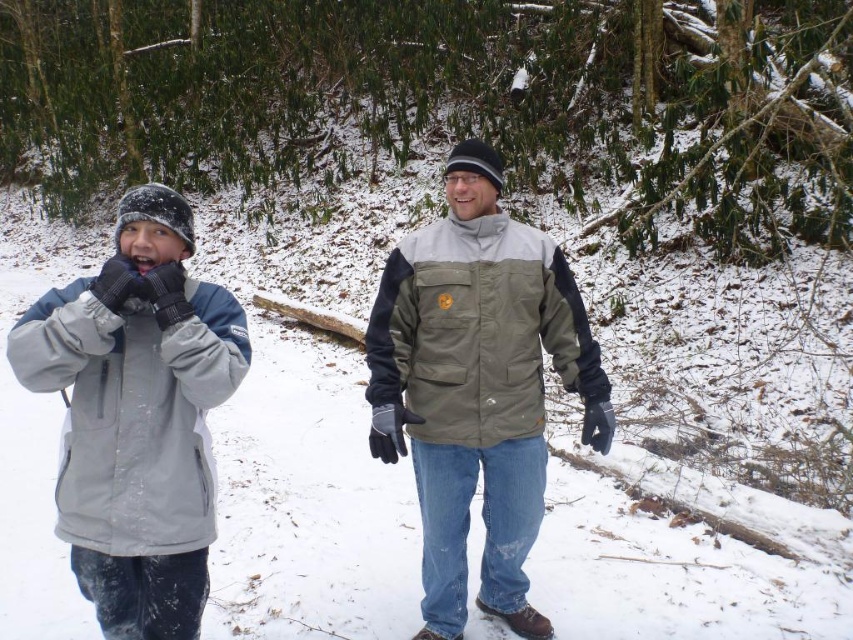
Question: Does matte gray jacket at center appear over gray soft jacket at left?

Choices:
 (A) yes
 (B) no

Answer: (B)

Question: Which point is closer to the camera?

Choices:
 (A) matte gray jacket at center
 (B) gray soft jacket at left

Answer: (B)

Question: Does matte gray jacket at center appear on the left side of gray soft jacket at left?

Choices:
 (A) no
 (B) yes

Answer: (A)

Question: Is matte gray jacket at center positioned at the back of gray soft jacket at left?

Choices:
 (A) yes
 (B) no

Answer: (A)